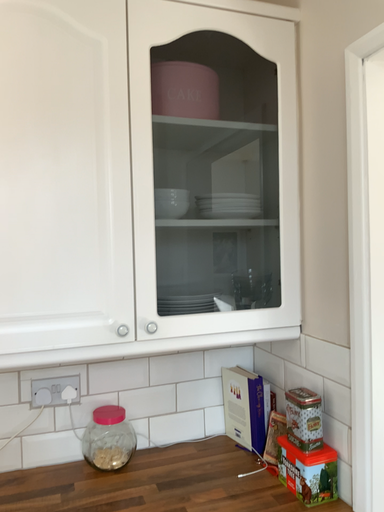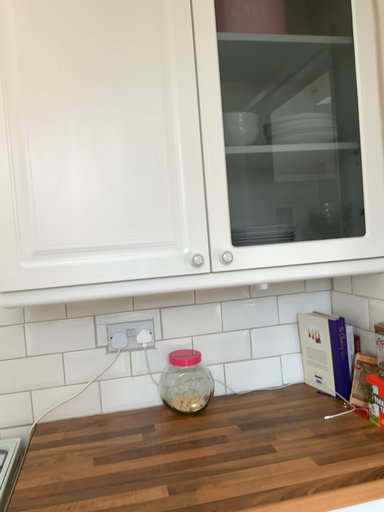
Question: Which way did the camera rotate in the video?

Choices:
 (A) rotated left
 (B) rotated right

Answer: (A)